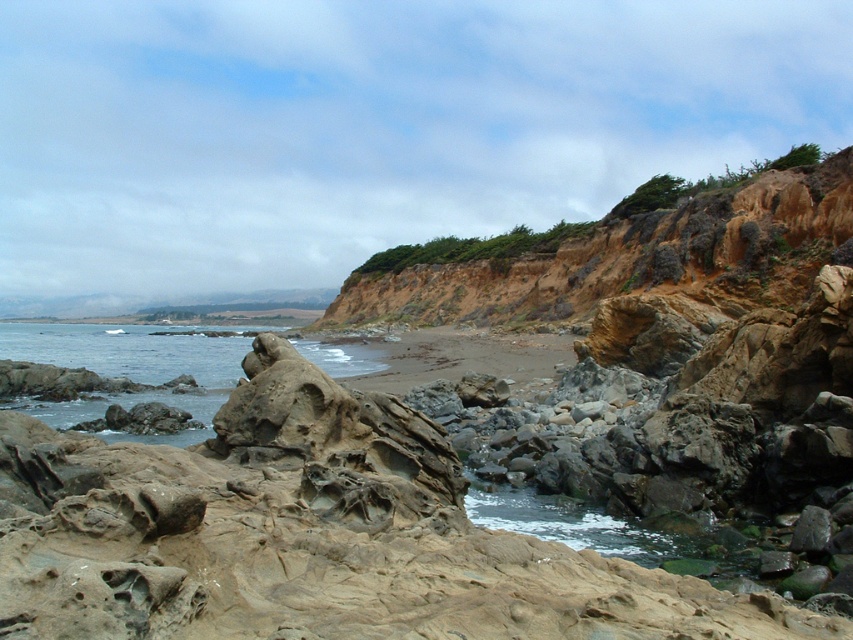
Consider the image. Is brown rocky cliff at upper right positioned before clear water at center?

No, brown rocky cliff at upper right is behind clear water at center.

Is brown rocky cliff at upper right thinner than clear water at center?

Correct, brown rocky cliff at upper right's width is less than clear water at center's.

Is point (338, 324) positioned in front of point (82, 355)?

No, (338, 324) is behind (82, 355).

This screenshot has height=640, width=853. In order to click on brown rocky cliff at upper right in this screenshot , I will do `click(631, 259)`.